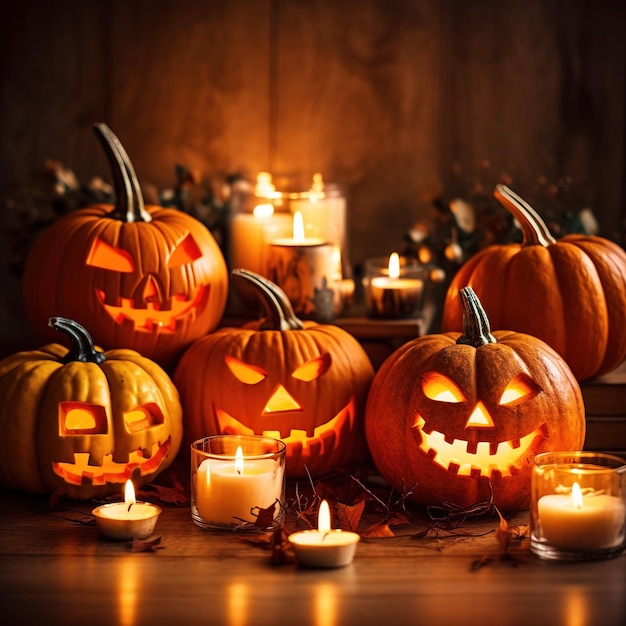
In order to click on wall in this screenshot , I will do `click(337, 74)`.